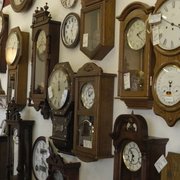
I want to click on glass, so click(x=130, y=60), click(x=42, y=71), click(x=95, y=36).